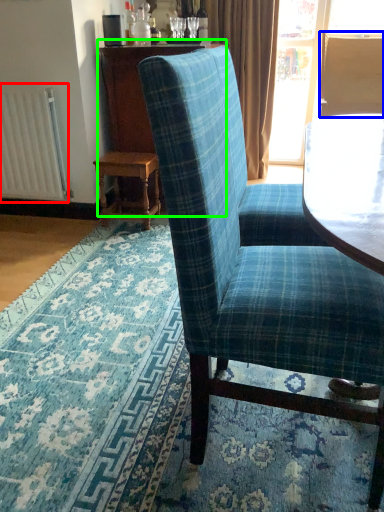
Question: Which is nearer to the radiator (highlighted by a red box)? back (highlighted by a blue box) or dresser (highlighted by a green box).

Choices:
 (A) back
 (B) dresser

Answer: (B)